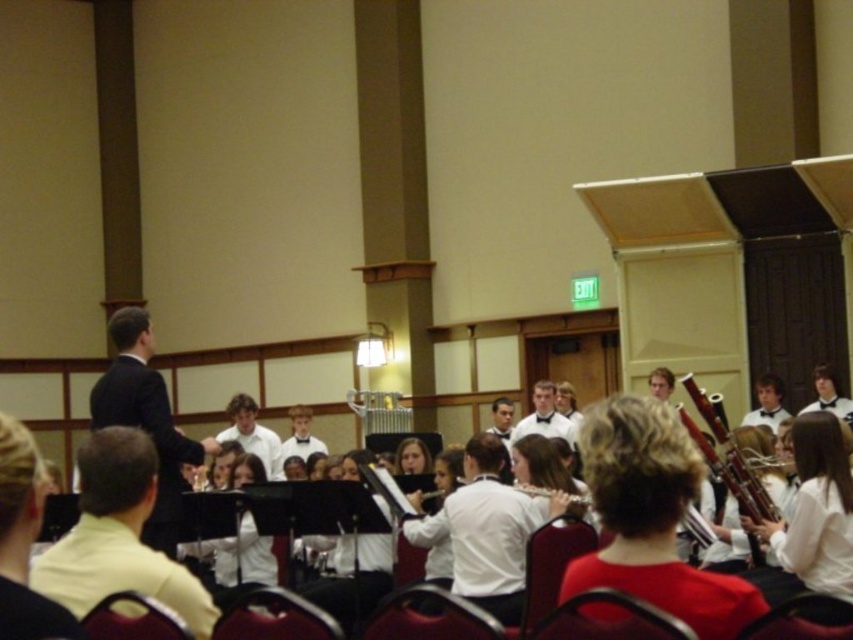
Question: Which object appears farthest from the camera in this image?

Choices:
 (A) white smooth shirt at center
 (B) black suit at left
 (C) white bow tie at center

Answer: (A)

Question: Which of the following is the farthest from the observer?

Choices:
 (A) white bow tie at center
 (B) black suit at left
 (C) white wood flute at center

Answer: (A)

Question: Does black suit at left have a smaller size compared to white bow tie at center?

Choices:
 (A) yes
 (B) no

Answer: (B)

Question: Is black suit at left in front of white bow tie at center?

Choices:
 (A) yes
 (B) no

Answer: (A)

Question: Considering the real-world distances, which object is farthest from the black suit at left?

Choices:
 (A) white bow tie at center
 (B) wooden bassoon at right

Answer: (A)

Question: Can you confirm if black suit at left is thinner than white wood flute at center?

Choices:
 (A) no
 (B) yes

Answer: (A)